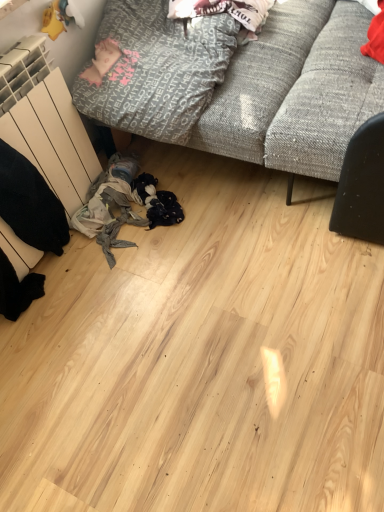
Describe the element at coordinates (224, 10) in the screenshot. This screenshot has width=384, height=512. I see `white cotton t-shirt at upper center, which appears as the second clothing when ordered from the bottom` at that location.

The image size is (384, 512). I want to click on textured gray couch at upper center, so click(296, 91).

Considering the sizes of objects white cotton t-shirt at upper center, which appears as the second clothing when ordered from the bottom, and textured gray blanket at upper left, which appears as the 2th clothing when viewed from the top, in the image provided, who is smaller, white cotton t-shirt at upper center, which appears as the second clothing when ordered from the bottom, or textured gray blanket at upper left, which appears as the 2th clothing when viewed from the top,?

white cotton t-shirt at upper center, which appears as the second clothing when ordered from the bottom, is smaller.

Measure the distance from white cotton t-shirt at upper center, the first clothing positioned from the top, to textured gray blanket at upper left, which appears as the first clothing when ordered from the bottom.

white cotton t-shirt at upper center, the first clothing positioned from the top, and textured gray blanket at upper left, which appears as the first clothing when ordered from the bottom, are 23.96 centimeters apart from each other.

Can you confirm if white cotton t-shirt at upper center, which appears as the second clothing when ordered from the bottom, is shorter than textured gray blanket at upper left, which appears as the 2th clothing when viewed from the top?

Yes.

From the image's perspective, is white cotton t-shirt at upper center, which appears as the second clothing when ordered from the bottom, under textured gray blanket at upper left, which appears as the 2th clothing when viewed from the top?

No.

Can you confirm if textured gray blanket at upper left, which appears as the 2th clothing when viewed from the top, is shorter than textured gray couch at upper center?

Indeed, textured gray blanket at upper left, which appears as the 2th clothing when viewed from the top, has a lesser height compared to textured gray couch at upper center.

Which is in front, point (153, 51) or point (353, 47)?

The point (153, 51) is in front.

Which object is thinner, textured gray blanket at upper left, which appears as the first clothing when ordered from the bottom, or textured gray couch at upper center?

textured gray blanket at upper left, which appears as the first clothing when ordered from the bottom, is thinner.

From a real-world perspective, between textured gray blanket at upper left, which appears as the first clothing when ordered from the bottom, and textured gray couch at upper center, who is vertically higher?

textured gray blanket at upper left, which appears as the first clothing when ordered from the bottom.

Locate an element on the screen. studio couch below the textured gray blanket at upper left, which appears as the first clothing when ordered from the bottom (from a real-world perspective) is located at coordinates (296, 91).

Which is nearer, (x=361, y=29) or (x=108, y=74)?

Positioned in front is point (x=108, y=74).

Can you confirm if textured gray couch at upper center is wider than textured gray blanket at upper left, which appears as the 2th clothing when viewed from the top?

Yes.

Are textured gray couch at upper center and white cotton t-shirt at upper center, the first clothing positioned from the top, making contact?

No, textured gray couch at upper center is not with white cotton t-shirt at upper center, the first clothing positioned from the top.

From a real-world perspective, which object rests below the other?

In real-world perspective, textured gray couch at upper center is lower.

Between point (218, 151) and point (263, 20), which one is positioned in front?

The point (218, 151) is closer.

How many degrees apart are the facing directions of textured gray couch at upper center and white cotton t-shirt at upper center, which appears as the second clothing when ordered from the bottom?

The facing directions of textured gray couch at upper center and white cotton t-shirt at upper center, which appears as the second clothing when ordered from the bottom, are 5.34 degrees apart.

From the picture: Is white cotton t-shirt at upper center, the first clothing positioned from the top, facing towards textured gray couch at upper center?

Yes, white cotton t-shirt at upper center, the first clothing positioned from the top, is turned towards textured gray couch at upper center.

This screenshot has width=384, height=512. In order to click on studio couch below the white cotton t-shirt at upper center, which appears as the second clothing when ordered from the bottom (from the image's perspective) in this screenshot , I will do `click(296, 91)`.

Does white cotton t-shirt at upper center, which appears as the second clothing when ordered from the bottom, have a smaller size compared to textured gray couch at upper center?

Indeed, white cotton t-shirt at upper center, which appears as the second clothing when ordered from the bottom, has a smaller size compared to textured gray couch at upper center.

Is white cotton t-shirt at upper center, the first clothing positioned from the top, beside textured gray couch at upper center?

No, white cotton t-shirt at upper center, the first clothing positioned from the top, is not with textured gray couch at upper center.

Is textured gray blanket at upper left, which appears as the 2th clothing when viewed from the top, to the right of white cotton t-shirt at upper center, which appears as the second clothing when ordered from the bottom, from the viewer's perspective?

No, textured gray blanket at upper left, which appears as the 2th clothing when viewed from the top, is not to the right of white cotton t-shirt at upper center, which appears as the second clothing when ordered from the bottom.

In the scene shown: Is textured gray blanket at upper left, which appears as the first clothing when ordered from the bottom, not near white cotton t-shirt at upper center, which appears as the second clothing when ordered from the bottom?

No, textured gray blanket at upper left, which appears as the first clothing when ordered from the bottom, is not far from white cotton t-shirt at upper center, which appears as the second clothing when ordered from the bottom.

Can you confirm if textured gray blanket at upper left, which appears as the first clothing when ordered from the bottom, is thinner than white cotton t-shirt at upper center, which appears as the second clothing when ordered from the bottom?

Incorrect, the width of textured gray blanket at upper left, which appears as the first clothing when ordered from the bottom, is not less than that of white cotton t-shirt at upper center, which appears as the second clothing when ordered from the bottom.

I want to click on clothing behind the textured gray blanket at upper left, which appears as the first clothing when ordered from the bottom, so click(224, 10).

Where is `studio couch above the textured gray blanket at upper left, which appears as the first clothing when ordered from the bottom (from the image's perspective)`? studio couch above the textured gray blanket at upper left, which appears as the first clothing when ordered from the bottom (from the image's perspective) is located at coordinates (296, 91).

Looking at the image, which one is located closer to white cotton t-shirt at upper center, the first clothing positioned from the top, textured gray couch at upper center or textured gray blanket at upper left, which appears as the 2th clothing when viewed from the top?

textured gray blanket at upper left, which appears as the 2th clothing when viewed from the top.

When comparing their distances from white cotton t-shirt at upper center, which appears as the second clothing when ordered from the bottom, does textured gray blanket at upper left, which appears as the 2th clothing when viewed from the top, or textured gray couch at upper center seem further?

Among the two, textured gray couch at upper center is located further to white cotton t-shirt at upper center, which appears as the second clothing when ordered from the bottom.

Which object lies further to the anchor point textured gray blanket at upper left, which appears as the first clothing when ordered from the bottom, textured gray couch at upper center or white cotton t-shirt at upper center, the first clothing positioned from the top?

white cotton t-shirt at upper center, the first clothing positioned from the top, is further to textured gray blanket at upper left, which appears as the first clothing when ordered from the bottom.

Which object lies nearer to the anchor point textured gray couch at upper center, white cotton t-shirt at upper center, the first clothing positioned from the top, or textured gray blanket at upper left, which appears as the 2th clothing when viewed from the top?

textured gray blanket at upper left, which appears as the 2th clothing when viewed from the top.

Which object lies further to the anchor point textured gray couch at upper center, textured gray blanket at upper left, which appears as the 2th clothing when viewed from the top, or white cotton t-shirt at upper center, which appears as the second clothing when ordered from the bottom?

The object further to textured gray couch at upper center is white cotton t-shirt at upper center, which appears as the second clothing when ordered from the bottom.

From the image, which object appears to be nearer to textured gray blanket at upper left, which appears as the first clothing when ordered from the bottom, white cotton t-shirt at upper center, which appears as the second clothing when ordered from the bottom, or textured gray couch at upper center?

Among the two, textured gray couch at upper center is located nearer to textured gray blanket at upper left, which appears as the first clothing when ordered from the bottom.

Identify the location of clothing between textured gray couch at upper center and white cotton t-shirt at upper center, the first clothing positioned from the top, along the z-axis. (153, 70).